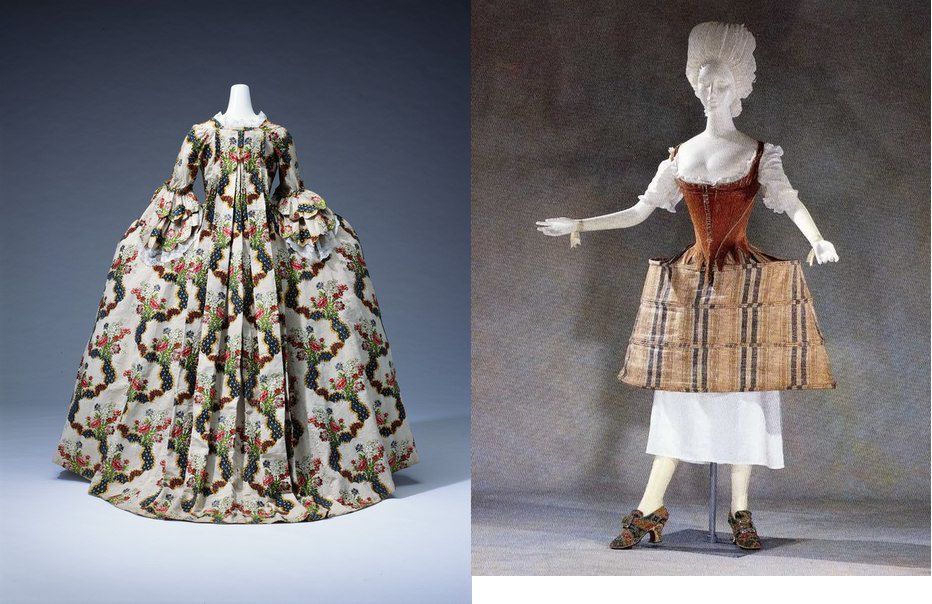
Identify the location of mannequin stand. This screenshot has width=932, height=604. (715, 544).